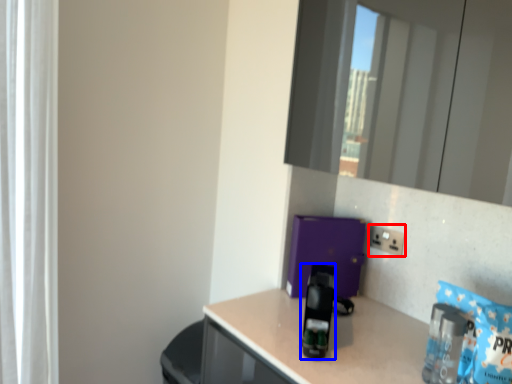
Question: Which point is closer to the camera, electric outlet (highlighted by a red box) or appliance (highlighted by a blue box)?

Choices:
 (A) electric outlet
 (B) appliance

Answer: (B)